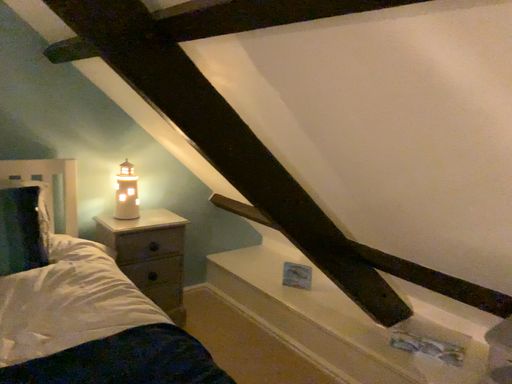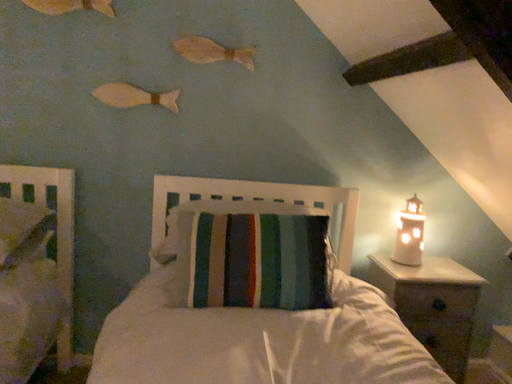
Question: How did the camera likely rotate when shooting the video?

Choices:
 (A) rotated right
 (B) rotated left

Answer: (B)